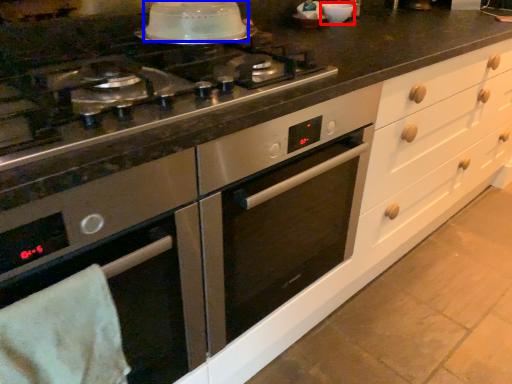
Question: Which point is closer to the camera, appliance (highlighted by a red box) or kitchen appliance (highlighted by a blue box)?

Choices:
 (A) appliance
 (B) kitchen appliance

Answer: (B)